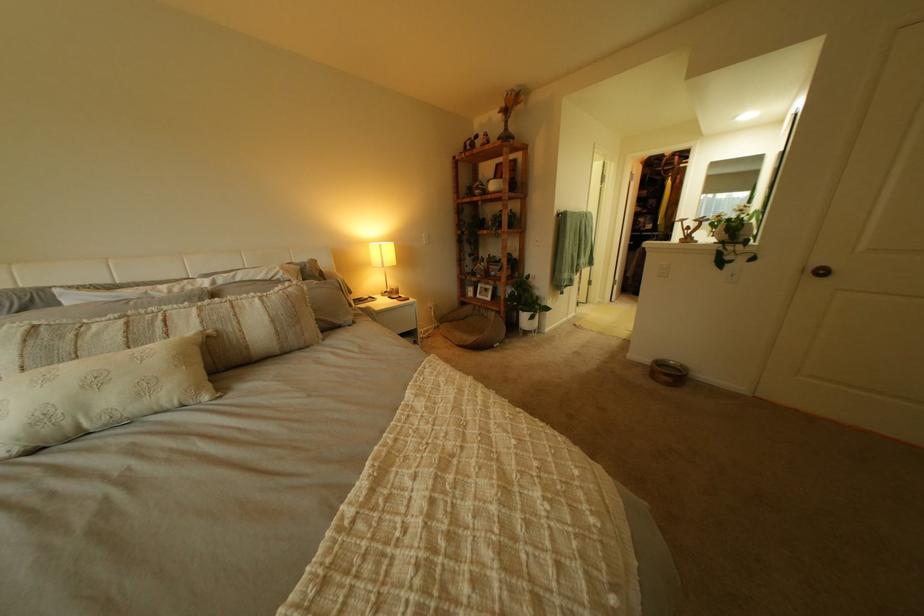
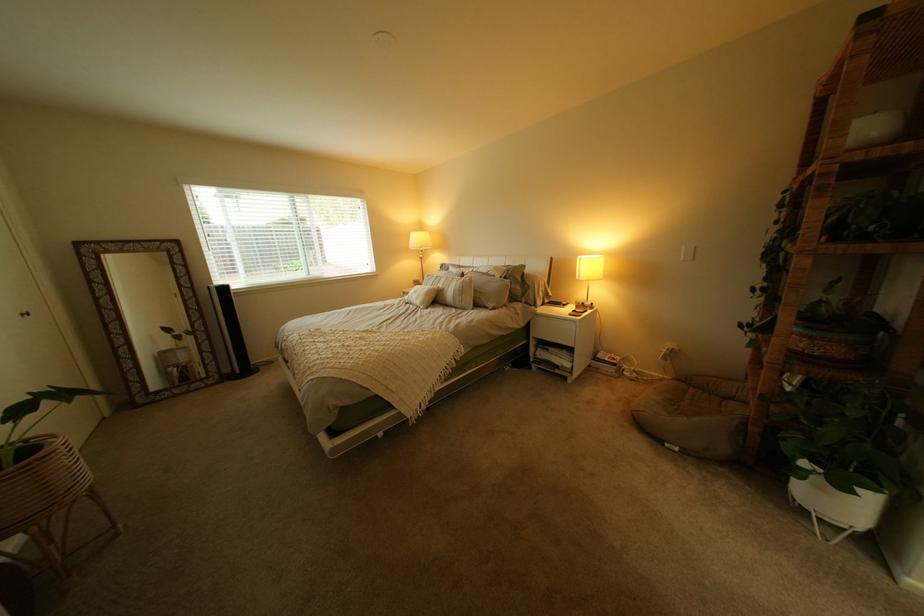
The point at (246, 329) is marked in the first image. Where is the corresponding point in the second image?

(462, 290)